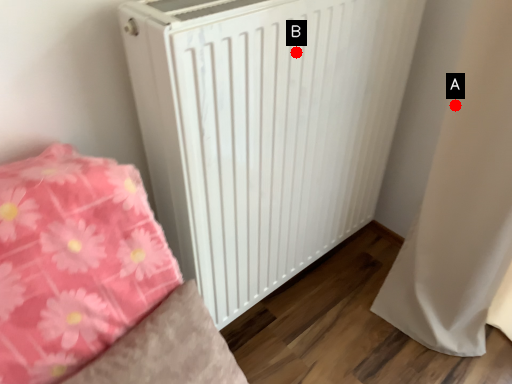
Question: Two points are circled on the image, labeled by A and B beside each circle. Which point is closer to the camera?

Choices:
 (A) A is closer
 (B) B is closer

Answer: (B)